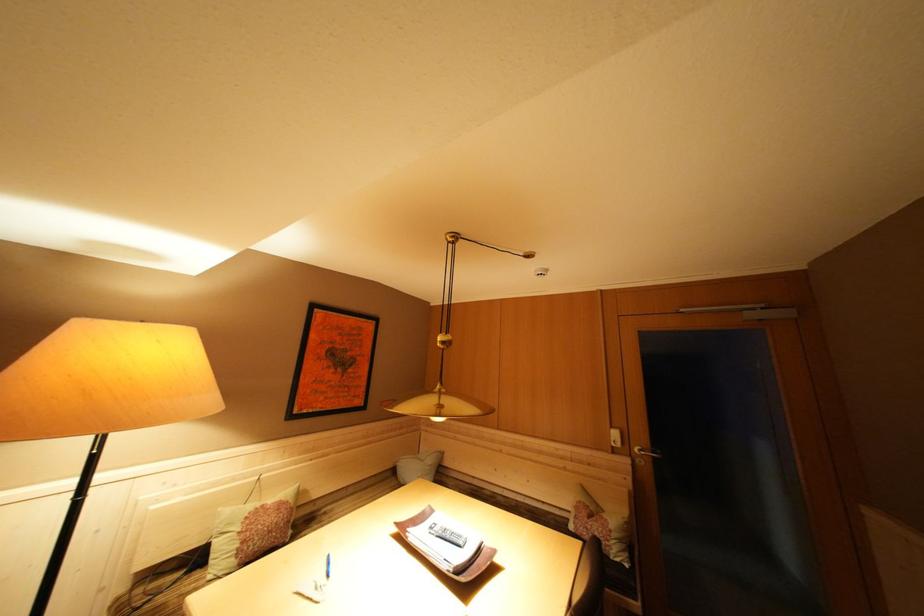
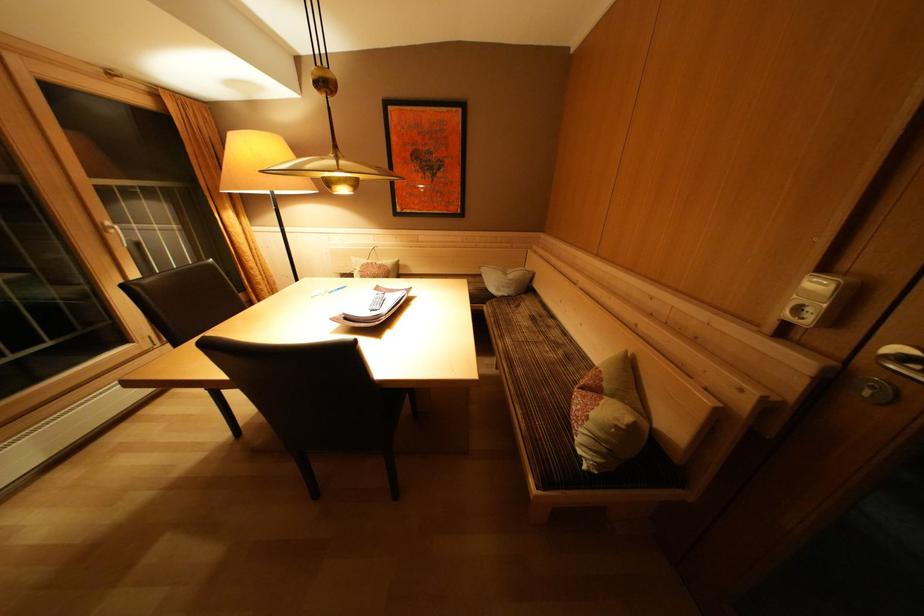
Where in the second image is the point corresponding to pixel 499 501 from the first image?

(555, 331)